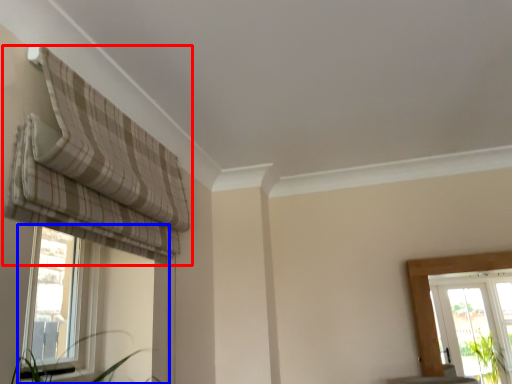
Question: Which of the following is the closest to the observer, curtain (highlighted by a red box) or window (highlighted by a blue box)?

Choices:
 (A) curtain
 (B) window

Answer: (A)